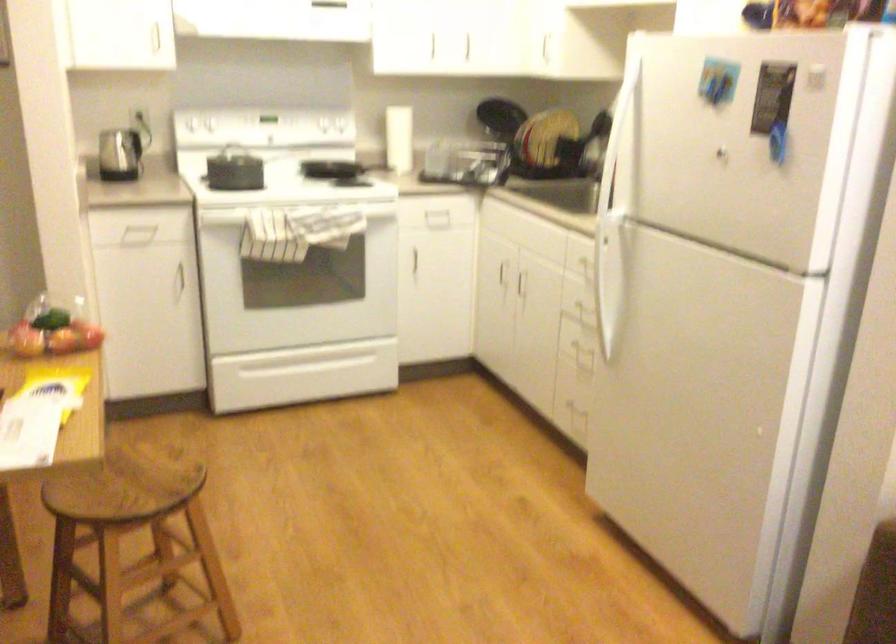
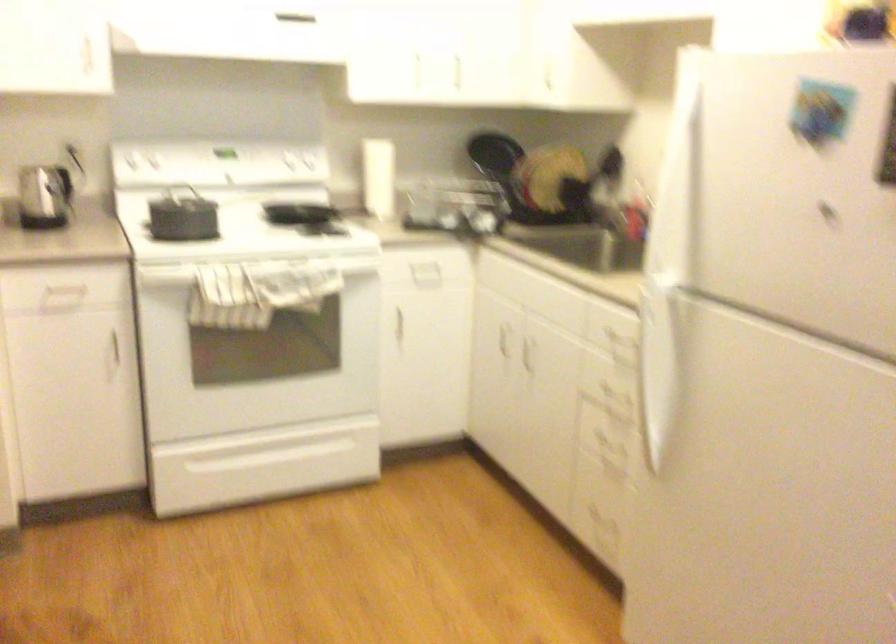
In the second image, find the point that corresponds to (x=144, y=299) in the first image.

(73, 379)